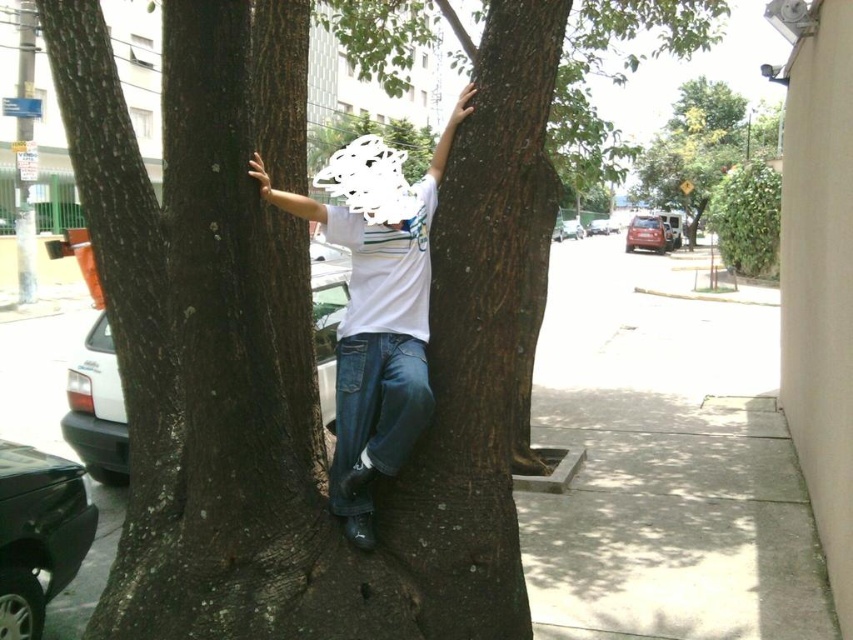
You are a photographer aiming to capture the white matte shirt at center and the green leafy tree at upper right in a single shot. Based on their positions, which object will appear larger in the photo?

The white matte shirt at center will appear larger in the photo because it is closer to the viewer than the green leafy tree at upper right.

Consider the image. You are a photographer aiming to capture the white matte shirt at center and the green leafy tree at upper right in a single frame. Based on their widths, which object should you focus on to ensure both fit in the photo without cropping?

The white matte shirt at center has a lesser width compared to green leafy tree at upper right, so you should focus on the green leafy tree at upper right to ensure both fit in the photo without cropping.

You are a photographer capturing the scene of a person climbing between two trees. You notice the white matte shirt at center and the green leafy tree at upper right. Which object is closer to the camera based on their sizes?

The white matte shirt at center is shorter than the green leafy tree at upper right, so the shirt is closer to the camera because objects closer to the camera appear smaller than those further away.